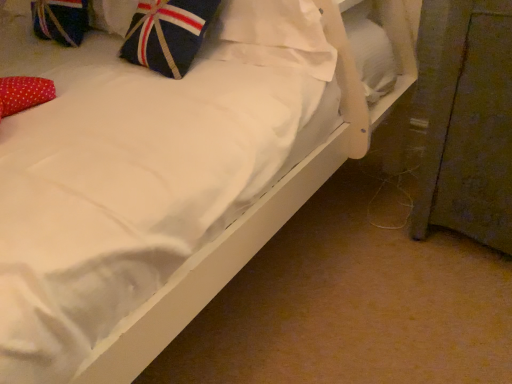
Identify the location of free region on the left part of wooden dresser at lower right. The image size is (512, 384). (358, 231).